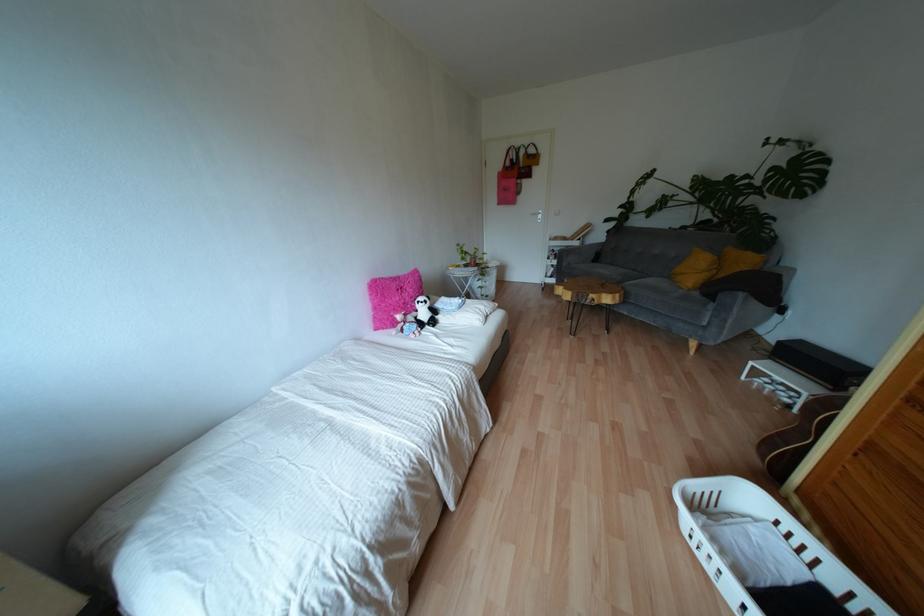
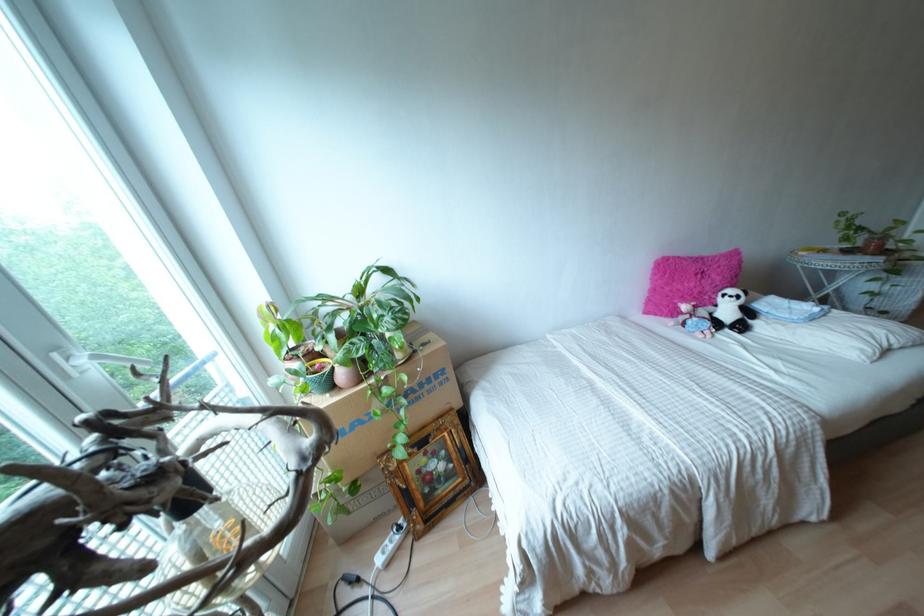
Locate, in the second image, the point that corresponds to [438,304] in the first image.

(759, 305)